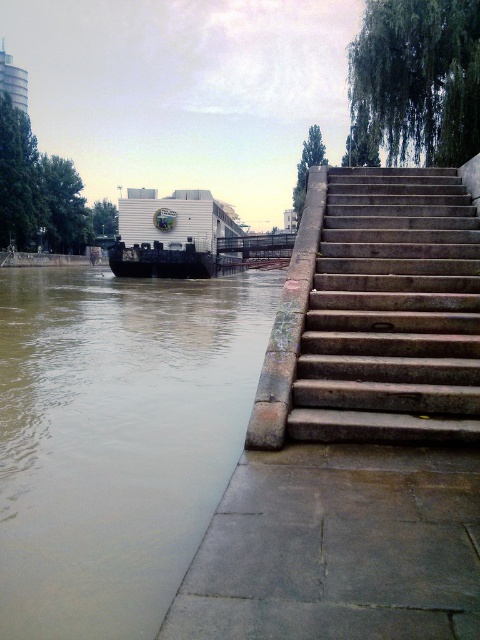
Which is below, stone steps at right or white matte barge at center-left?

stone steps at right is lower down.

Which of these two, stone steps at right or white matte barge at center-left, stands taller?

white matte barge at center-left

Which is in front, point (363, 173) or point (230, 250)?

Point (363, 173) is more forward.

In order to click on stone steps at right in this screenshot , I will do `click(392, 312)`.

Is point (101, 420) farther from viewer compared to point (120, 244)?

No.

Measure the distance between point (244,356) and camera.

33.00 feet

Does point (135, 600) come behind point (122, 243)?

No, (135, 600) is in front of (122, 243).

At what (x,y) coordinates should I click in order to perform the action: click on brown concrete river at lower left. Please return your answer as a coordinate pair (x, y). Looking at the image, I should click on point(117,438).

Does brown concrete river at lower left have a lesser width compared to stone steps at right?

No.

Based on the photo, can you confirm if brown concrete river at lower left is positioned below stone steps at right?

No, brown concrete river at lower left is not below stone steps at right.

Does point (38, 525) lie in front of point (348, 419)?

Yes, it is.

The height and width of the screenshot is (640, 480). Find the location of `brown concrete river at lower left`. brown concrete river at lower left is located at coordinates (117, 438).